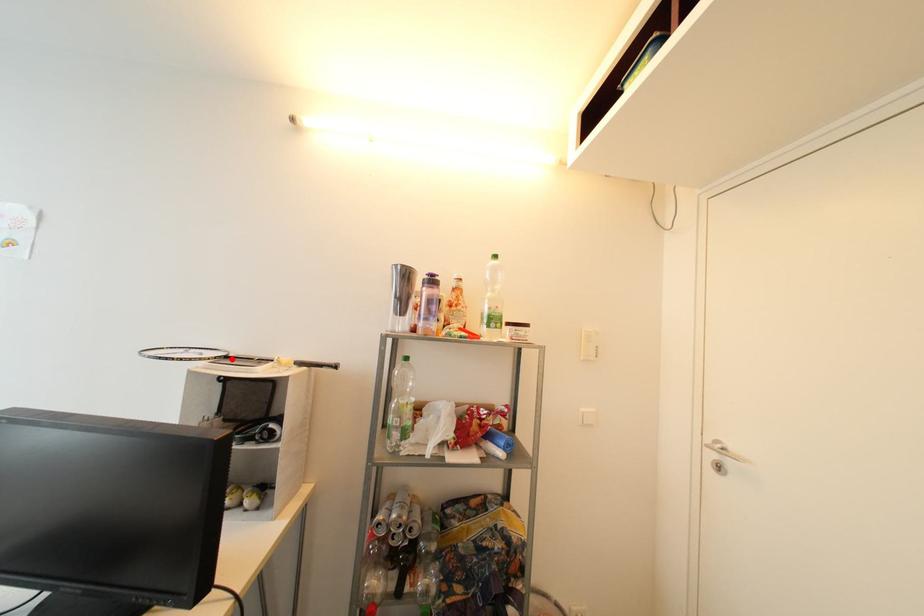
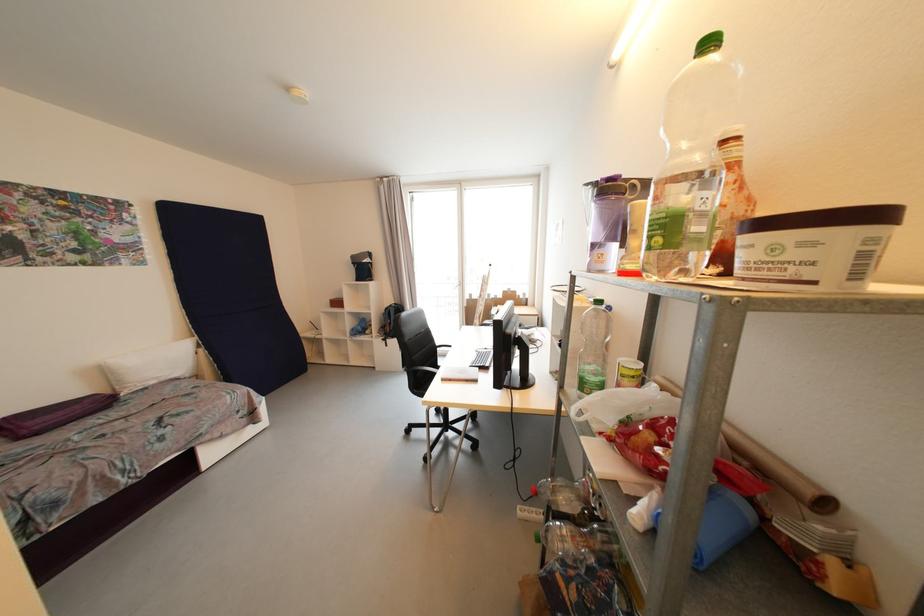
Question: I am providing you with two images of the same scene from different viewpoints. A red point is marked on the first image. Can you still see the location of the red point in image 2?

Choices:
 (A) Yes
 (B) No

Answer: (B)